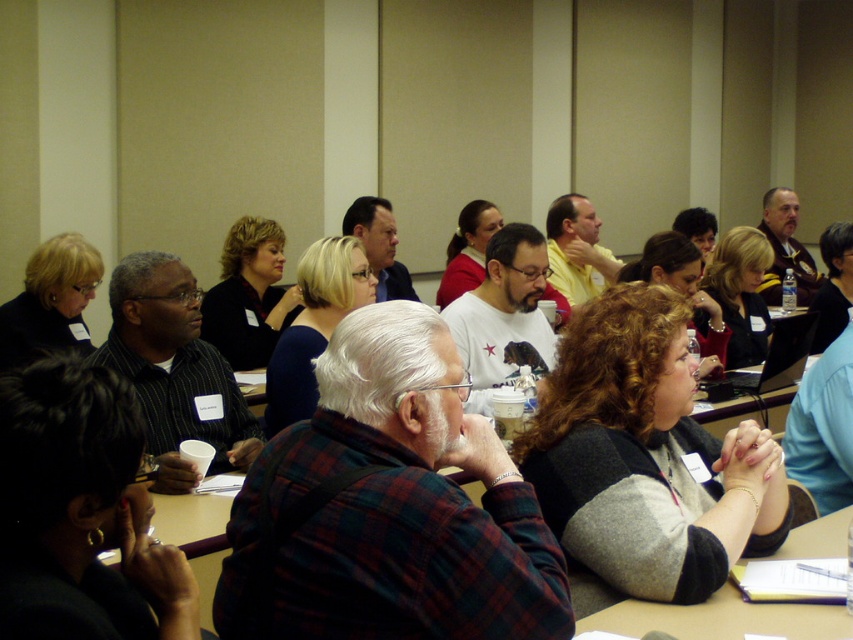
Question: Is blue fabric shirt at center positioned at the back of matte black sweater at upper left?

Choices:
 (A) yes
 (B) no

Answer: (B)

Question: Which point is closer to the camera?

Choices:
 (A) blonde hair at center
 (B) gray fabric at lower right
 (C) curly hair at center
 (D) curly hair sweater at center

Answer: (B)

Question: Is blue fabric shirt at center smaller than curly hair at center?

Choices:
 (A) no
 (B) yes

Answer: (B)

Question: Among these objects, which one is nearest to the camera?

Choices:
 (A) blue fabric shirt at center
 (B) matte black sweater at upper left

Answer: (A)

Question: Can you confirm if black sweater at center is thinner than curly hair at center?

Choices:
 (A) yes
 (B) no

Answer: (A)

Question: Which of the following is the closest to the observer?

Choices:
 (A) black sweater at center
 (B) blue fabric shirt at center
 (C) matte black sweater at upper left

Answer: (B)